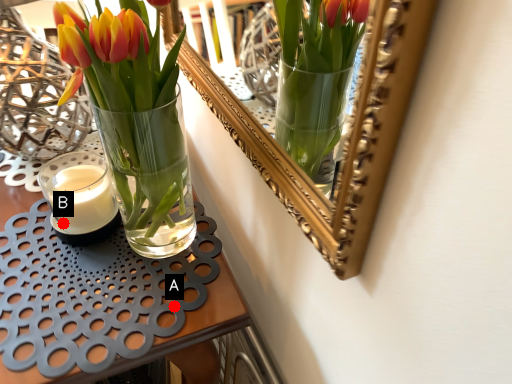
Question: Two points are circled on the image, labeled by A and B beside each circle. Which point is closer to the camera taking this photo?

Choices:
 (A) A is closer
 (B) B is closer

Answer: (A)